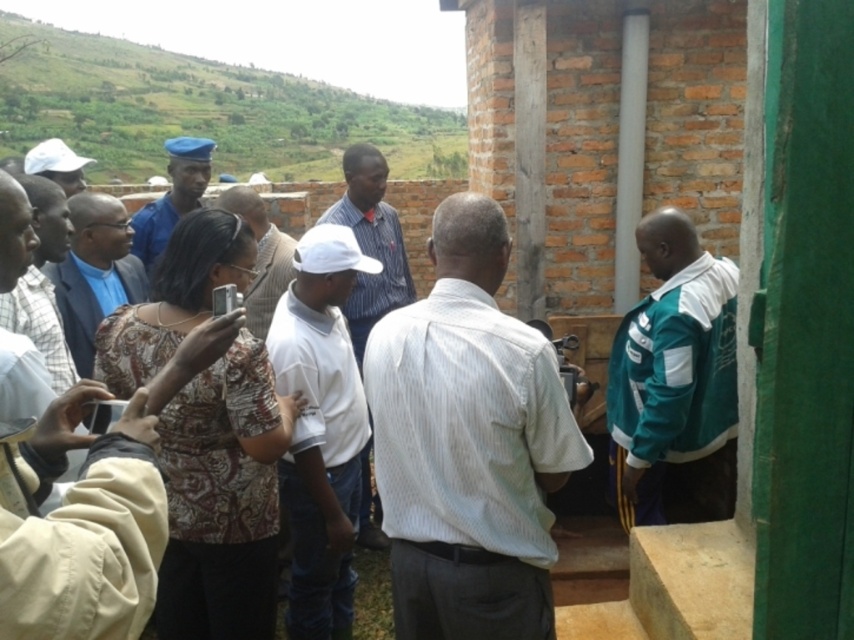
Question: Can you confirm if white textured shirt at center is positioned above white matte shirt at center?

Choices:
 (A) no
 (B) yes

Answer: (B)

Question: Considering the real-world distances, which object is closest to the white matte shirt at center?

Choices:
 (A) striped shirt at center
 (B) teal fabric jacket at right
 (C) matte blue shirt at center
 (D) white textured shirt at center

Answer: (D)

Question: Among these points, which one is farthest from the camera?

Choices:
 (A) (291, 256)
 (B) (51, 156)
 (C) (427, 516)

Answer: (B)

Question: Considering the real-world distances, which object is farthest from the white textured shirt at center?

Choices:
 (A) white shirt at center
 (B) white matte cap at upper left

Answer: (B)

Question: Does teal fabric jacket at right appear under white shirt at center?

Choices:
 (A) no
 (B) yes

Answer: (B)

Question: In this image, where is matte blue shirt at center located relative to white matte cap at upper left?

Choices:
 (A) below
 (B) above

Answer: (A)